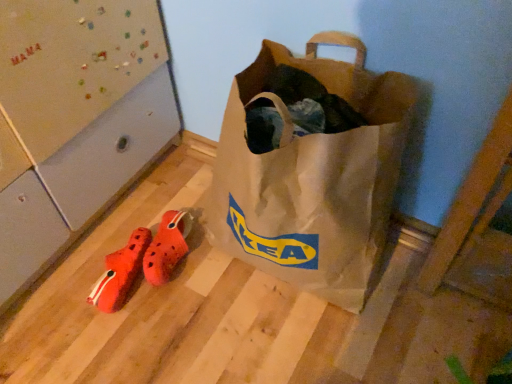
This screenshot has width=512, height=384. What are the coordinates of `free space between matte brown paper bag at center and orange rubber clogs at lower left` in the screenshot? It's located at (223, 284).